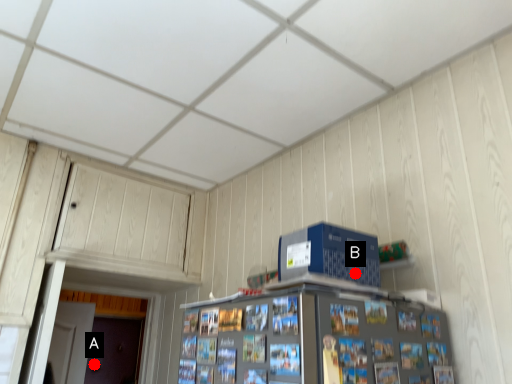
Question: Two points are circled on the image, labeled by A and B beside each circle. Which point is closer to the camera?

Choices:
 (A) A is closer
 (B) B is closer

Answer: (B)